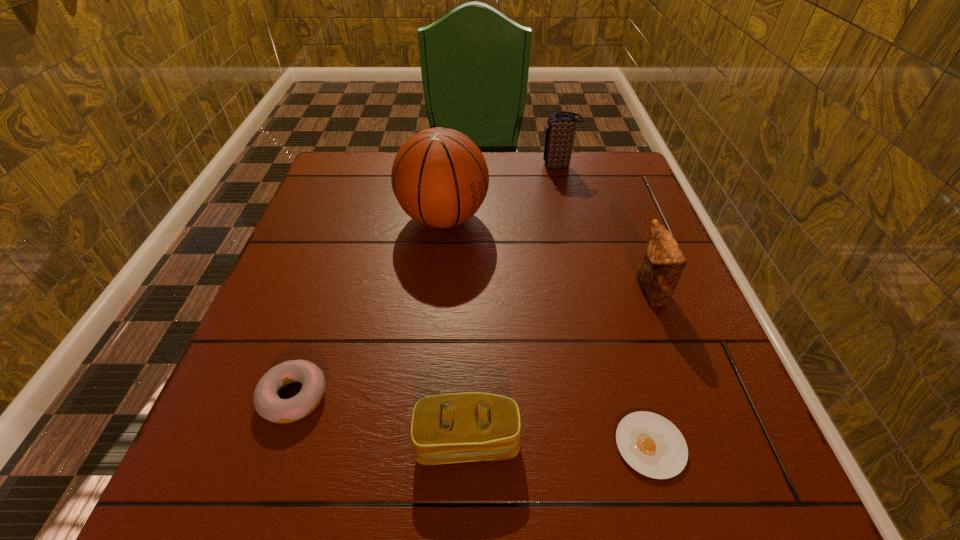
The height and width of the screenshot is (540, 960). What are the coordinates of `the second farthest object` in the screenshot? It's located at (440, 178).

Image resolution: width=960 pixels, height=540 pixels. Identify the location of basketball. (440, 178).

Identify the location of the second clutch bag from right to left. The image size is (960, 540). (560, 128).

The image size is (960, 540). What are the coordinates of `the farthest object` in the screenshot? It's located at (560, 128).

Locate an element on the screen. The height and width of the screenshot is (540, 960). the second nearest clutch bag is located at coordinates (660, 271).

This screenshot has width=960, height=540. What are the coordinates of `the fourth nearest object` in the screenshot? It's located at pyautogui.click(x=660, y=271).

Locate an element on the screen. the leftmost clutch bag is located at coordinates (459, 427).

Image resolution: width=960 pixels, height=540 pixels. I want to click on the fourth tallest object, so click(x=459, y=427).

Image resolution: width=960 pixels, height=540 pixels. Find the location of `doughnut`. doughnut is located at coordinates (267, 403).

The height and width of the screenshot is (540, 960). Find the location of `the leftmost object`. the leftmost object is located at coordinates coord(267,403).